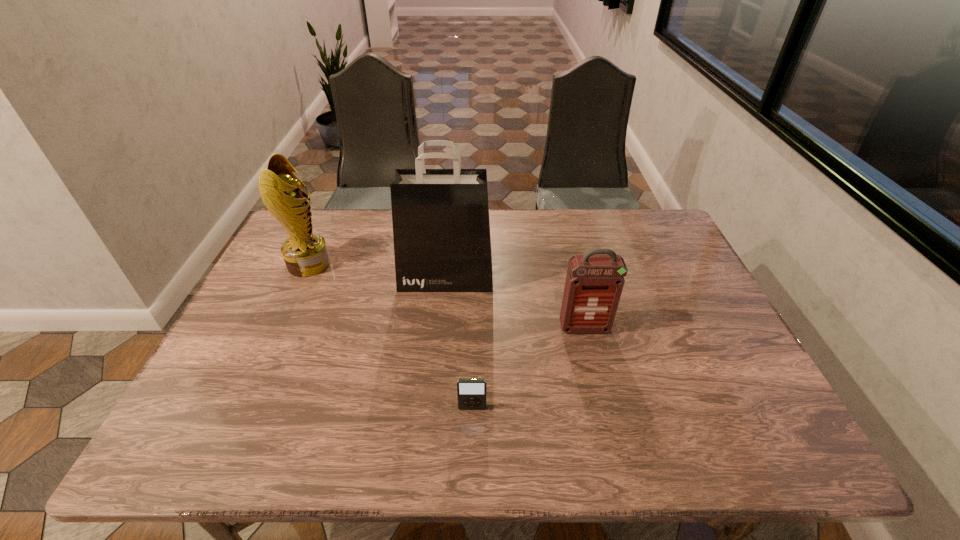
Where is `shopping bag`? shopping bag is located at coordinates (x=441, y=230).

You are a GUI agent. You are given a task and a screenshot of the screen. Output one action in this format:
    pyautogui.click(x=<x>, y=<y>)
    Task: Click on the award
    The width and height of the screenshot is (960, 540).
    Given the screenshot: What is the action you would take?
    pyautogui.click(x=305, y=253)

Where is `the third shortest object`? the third shortest object is located at coordinates (305, 253).

Locate an element on the screen. The image size is (960, 540). the third tallest object is located at coordinates (594, 283).

Find the location of a particular element. the second nearest object is located at coordinates (594, 283).

You are a GUI agent. You are given a task and a screenshot of the screen. Output one action in this format:
    pyautogui.click(x=<x>, y=<y>)
    Task: Click on the iPod
    The image size is (960, 540).
    Given the screenshot: What is the action you would take?
    pyautogui.click(x=471, y=393)

Image resolution: width=960 pixels, height=540 pixels. I want to click on the shortest object, so click(471, 393).

The width and height of the screenshot is (960, 540). What are the coordinates of `free region located on the front with handles of the tallest object` in the screenshot? It's located at (444, 313).

I want to click on free spot located 0.260m on the front-facing side of the award, so click(x=418, y=264).

Find the location of `vacant space located 0.080m on the front-facing side of the rightmost object`. vacant space located 0.080m on the front-facing side of the rightmost object is located at coordinates pos(592,360).